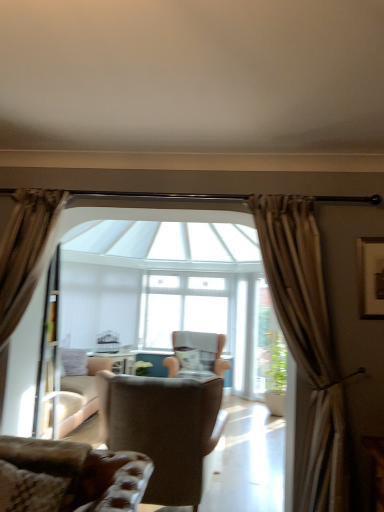
Question: Does velvet brown armchair at center, acting as the third chair starting from the front, have a smaller size compared to velvet gray pillow at center?

Choices:
 (A) no
 (B) yes

Answer: (A)

Question: Is velvet brown armchair at center, acting as the first chair starting from the back, positioned in front of velvet gray pillow at center?

Choices:
 (A) no
 (B) yes

Answer: (B)

Question: Is velvet brown armchair at center, acting as the first chair starting from the back, thinner than velvet gray pillow at center?

Choices:
 (A) no
 (B) yes

Answer: (A)

Question: Is velvet brown armchair at center, acting as the third chair starting from the front, at the left side of velvet gray pillow at center?

Choices:
 (A) no
 (B) yes

Answer: (A)

Question: Is velvet brown armchair at center, acting as the first chair starting from the back, positioned behind velvet gray pillow at center?

Choices:
 (A) no
 (B) yes

Answer: (A)

Question: Considering the positions of velvet gray pillow at center and clear glass window at center in the image, is velvet gray pillow at center taller or shorter than clear glass window at center?

Choices:
 (A) short
 (B) tall

Answer: (A)

Question: Is point (200, 354) closer or farther from the camera than point (220, 281)?

Choices:
 (A) closer
 (B) farther

Answer: (A)

Question: Is velvet gray pillow at center wider or thinner than clear glass window at center?

Choices:
 (A) wide
 (B) thin

Answer: (A)

Question: Based on their sizes in the image, would you say velvet gray pillow at center is bigger or smaller than clear glass window at center?

Choices:
 (A) big
 (B) small

Answer: (B)

Question: Looking at their shapes, would you say leather at lower left, which appears as the 1th chair when viewed from the front, is wider or thinner than wooden framed artwork at upper right?

Choices:
 (A) wide
 (B) thin

Answer: (A)

Question: In the image, is leather at lower left, which ranks as the 3th chair in back-to-front order, positioned in front of or behind wooden framed artwork at upper right?

Choices:
 (A) front
 (B) behind

Answer: (A)

Question: Is leather at lower left, which ranks as the 3th chair in back-to-front order, inside or outside of wooden framed artwork at upper right?

Choices:
 (A) outside
 (B) inside

Answer: (A)

Question: From a real-world perspective, is leather at lower left, which ranks as the 3th chair in back-to-front order, physically located above or below wooden framed artwork at upper right?

Choices:
 (A) below
 (B) above

Answer: (A)

Question: Looking at the image, does clear glass window at center seem bigger or smaller compared to brown leather armchair at center, marked as the second chair in a front-to-back arrangement?

Choices:
 (A) small
 (B) big

Answer: (A)

Question: Visually, is clear glass window at center positioned to the left or to the right of brown leather armchair at center, which ranks as the second chair in back-to-front order?

Choices:
 (A) right
 (B) left

Answer: (A)